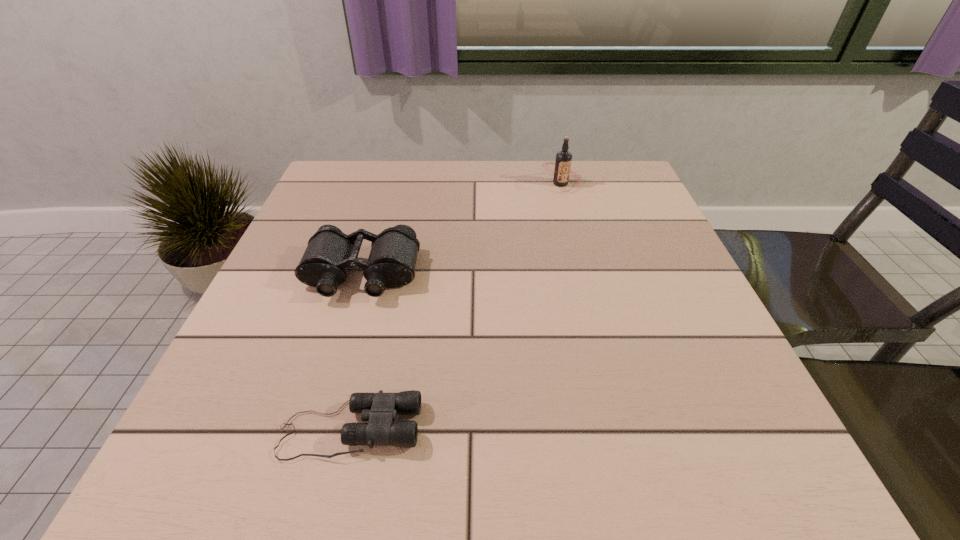
Locate an element on the screen. This screenshot has width=960, height=540. free space between the taller binoculars and the tallest object is located at coordinates (462, 229).

You are a GUI agent. You are given a task and a screenshot of the screen. Output one action in this format:
    pyautogui.click(x=<x>, y=<y>)
    Task: Click on the object that is the second closest to the second farthest object
    The image size is (960, 540).
    Given the screenshot: What is the action you would take?
    pyautogui.click(x=562, y=171)

Select which object is the second closest to the second shortest object. Please provide its 2D coordinates. Your answer should be formatted as a tuple, i.e. [(x, y)], where the tuple contains the x and y coordinates of a point satisfying the conditions above.

[(562, 171)]

The image size is (960, 540). I want to click on blank space that satisfies the following two spatial constraints: 1. on the label of the root beer; 2. at the eyepiece of the shortest object, so click(626, 429).

Where is `free location that satisfies the following two spatial constraints: 1. on the label of the tallest object; 2. at the eyepiece of the shorter binoculars`? Image resolution: width=960 pixels, height=540 pixels. free location that satisfies the following two spatial constraints: 1. on the label of the tallest object; 2. at the eyepiece of the shorter binoculars is located at coordinates (626, 429).

In order to click on vacant space that satisfies the following two spatial constraints: 1. on the label of the farthest object; 2. at the eyepiece of the shorter binoculars in this screenshot , I will do `click(626, 429)`.

Identify the location of vacant space that satisfies the following two spatial constraints: 1. on the label of the tallest object; 2. at the eyepiece of the shorter binoculars. (626, 429).

Identify the location of free spot that satisfies the following two spatial constraints: 1. on the label of the rightmost object; 2. at the eyepiece of the nearer binoculars. (626, 429).

Locate an element on the screen. vacant space that satisfies the following two spatial constraints: 1. on the label of the tallest object; 2. at the eyepiece of the nearest object is located at coordinates (626, 429).

At what (x,y) coordinates should I click in order to perform the action: click on vacant space that satisfies the following two spatial constraints: 1. on the label of the rightmost object; 2. at the eyepiece of the shorter binoculars. Please return your answer as a coordinate pair (x, y). Looking at the image, I should click on (626, 429).